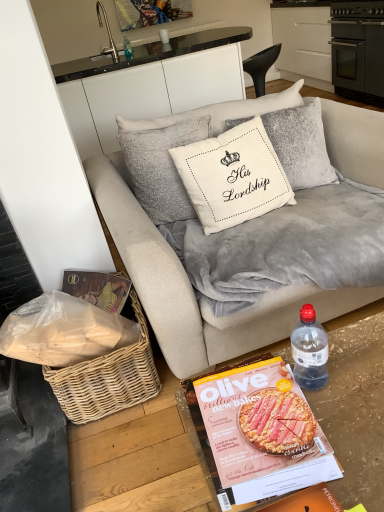
Question: From a real-world perspective, is silver metallic faucet at upper left on white glossy cup at upper center?

Choices:
 (A) yes
 (B) no

Answer: (A)

Question: Is silver metallic faucet at upper left to the left of white glossy cup at upper center from the viewer's perspective?

Choices:
 (A) yes
 (B) no

Answer: (A)

Question: Is silver metallic faucet at upper left with white glossy cup at upper center?

Choices:
 (A) no
 (B) yes

Answer: (A)

Question: Does silver metallic faucet at upper left have a smaller size compared to white glossy cup at upper center?

Choices:
 (A) yes
 (B) no

Answer: (B)

Question: Would you say silver metallic faucet at upper left contains white glossy cup at upper center?

Choices:
 (A) yes
 (B) no

Answer: (B)

Question: Is silver metallic faucet at upper left wider than white glossy cup at upper center?

Choices:
 (A) no
 (B) yes

Answer: (B)

Question: Is velvet beige couch at center placed right next to transparent plastic bottle at lower right, which is the 2th bottle from back to front?

Choices:
 (A) no
 (B) yes

Answer: (A)

Question: Is velvet beige couch at center positioned with its back to transparent plastic bottle at lower right, which is the 2th bottle from back to front?

Choices:
 (A) yes
 (B) no

Answer: (B)

Question: From a real-world perspective, is velvet beige couch at center located beneath transparent plastic bottle at lower right, the 2th bottle when ordered from top to bottom?

Choices:
 (A) yes
 (B) no

Answer: (A)

Question: Considering the relative positions of velvet beige couch at center and transparent plastic bottle at lower right, which is the 2th bottle from left to right, in the image provided, is velvet beige couch at center to the left of transparent plastic bottle at lower right, which is the 2th bottle from left to right, from the viewer's perspective?

Choices:
 (A) no
 (B) yes

Answer: (A)

Question: Is velvet beige couch at center outside of transparent plastic bottle at lower right, which is the first bottle in front-to-back order?

Choices:
 (A) no
 (B) yes

Answer: (B)

Question: Can you confirm if velvet beige couch at center is wider than transparent plastic bottle at lower right, which is the 2th bottle from back to front?

Choices:
 (A) yes
 (B) no

Answer: (A)

Question: Can you confirm if matte paper magazine at lower center is shorter than white cotton cushion at center?

Choices:
 (A) no
 (B) yes

Answer: (B)